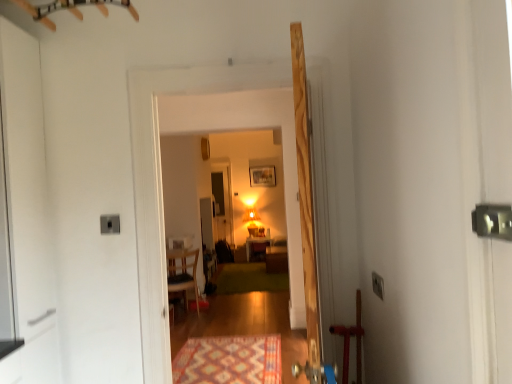
Question: Does green carpet at center, positioned as the 2th mat in front-to-back order, come in front of wooden door at center?

Choices:
 (A) yes
 (B) no

Answer: (B)

Question: Considering the relative sizes of green carpet at center, the first mat viewed from the back, and wooden door at center in the image provided, is green carpet at center, the first mat viewed from the back, thinner than wooden door at center?

Choices:
 (A) no
 (B) yes

Answer: (A)

Question: Is green carpet at center, the first mat viewed from the back, taller than wooden door at center?

Choices:
 (A) yes
 (B) no

Answer: (B)

Question: Is wooden door at center inside green carpet at center, the first mat viewed from the back?

Choices:
 (A) no
 (B) yes

Answer: (A)

Question: Considering the relative sizes of green carpet at center, the first mat viewed from the back, and wooden door at center in the image provided, is green carpet at center, the first mat viewed from the back, shorter than wooden door at center?

Choices:
 (A) no
 (B) yes

Answer: (B)

Question: Is multicolored woven mat at lower center, which ranks as the 1th mat in front-to-back order, in front of or behind matte wooden frame at upper center in the image?

Choices:
 (A) behind
 (B) front

Answer: (B)

Question: Is point (201, 370) positioned closer to the camera than point (261, 180)?

Choices:
 (A) closer
 (B) farther

Answer: (A)

Question: From a real-world perspective, is multicolored woven mat at lower center, which appears as the 2th mat when viewed from the back, above or below matte wooden frame at upper center?

Choices:
 (A) below
 (B) above

Answer: (A)

Question: Looking at the image, does multicolored woven mat at lower center, which appears as the 2th mat when viewed from the back, seem bigger or smaller compared to matte wooden frame at upper center?

Choices:
 (A) big
 (B) small

Answer: (A)

Question: Based on their positions, is matte wooden table at center located to the left or right of multicolored woven mat at lower center, which ranks as the 1th mat in front-to-back order?

Choices:
 (A) left
 (B) right

Answer: (B)

Question: Is matte wooden table at center situated inside multicolored woven mat at lower center, which ranks as the 1th mat in front-to-back order, or outside?

Choices:
 (A) inside
 (B) outside

Answer: (B)

Question: Relative to multicolored woven mat at lower center, which appears as the 2th mat when viewed from the back, is matte wooden table at center in front or behind?

Choices:
 (A) front
 (B) behind

Answer: (B)

Question: Considering the positions of point 249,248 and point 266,354, is point 249,248 closer or farther from the camera than point 266,354?

Choices:
 (A) farther
 (B) closer

Answer: (A)

Question: Is green carpet at center, the first mat viewed from the back, wider or thinner than matte wooden table at center?

Choices:
 (A) thin
 (B) wide

Answer: (B)

Question: Considering the positions of point (236, 276) and point (260, 246), is point (236, 276) closer or farther from the camera than point (260, 246)?

Choices:
 (A) closer
 (B) farther

Answer: (A)